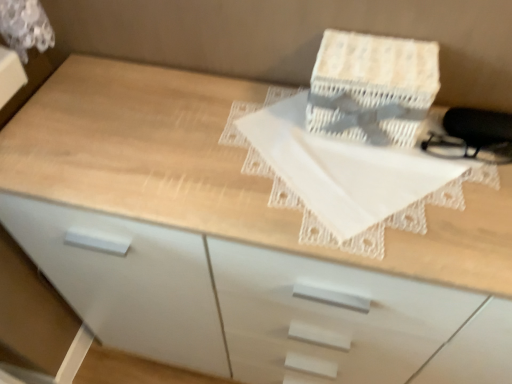
Where is `vacant space to the left of white lace cloth at center`? vacant space to the left of white lace cloth at center is located at coordinates (140, 140).